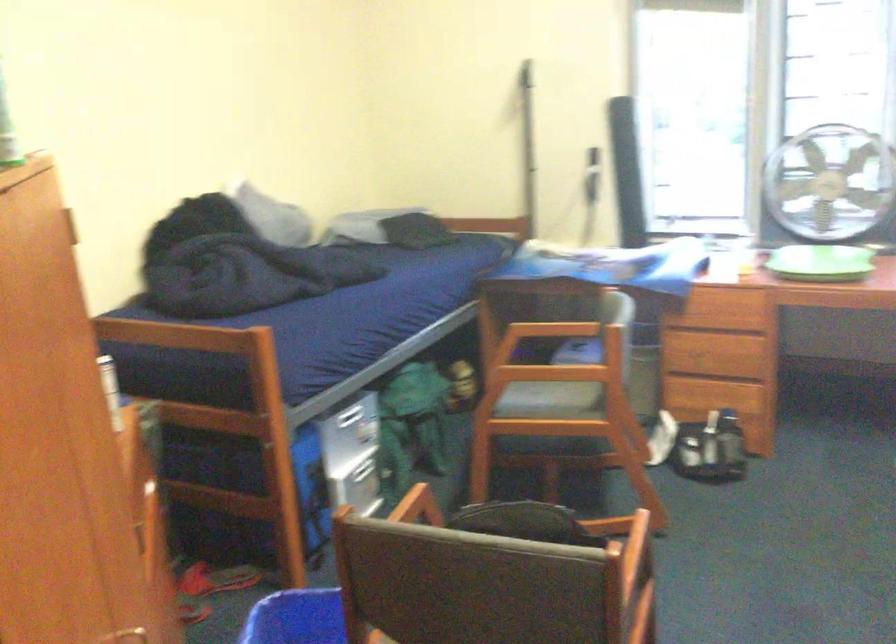
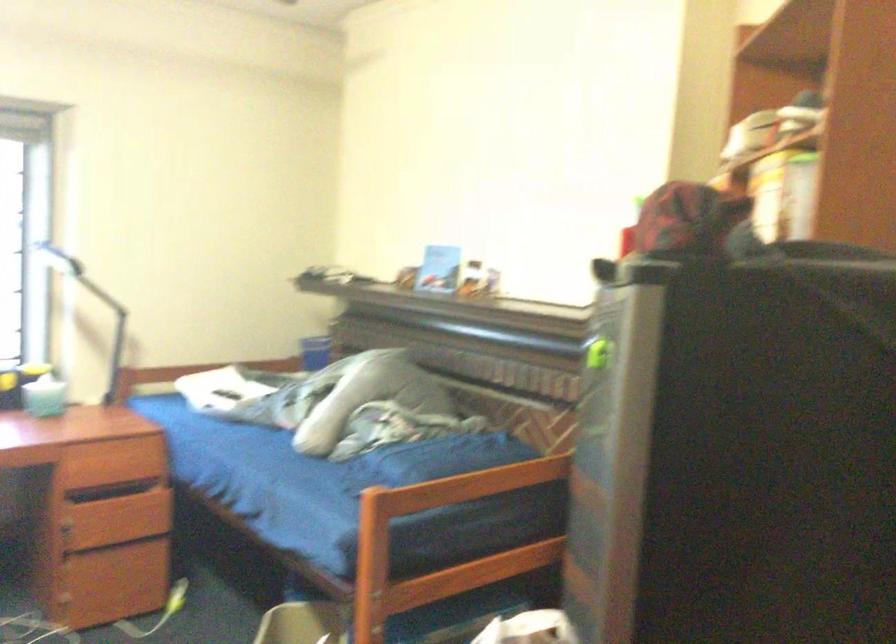
Question: The images are taken continuously from a first-person perspective. In which direction is your viewpoint rotating?

Choices:
 (A) Left
 (B) Right
 (C) Up
 (D) Down

Answer: (B)